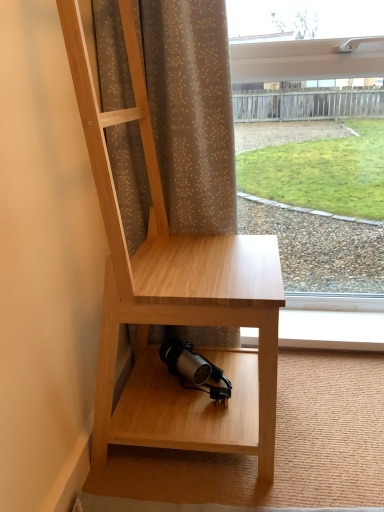
Question: Does point (140, 328) appear closer or farther from the camera than point (140, 203)?

Choices:
 (A) farther
 (B) closer

Answer: (A)

Question: From a real-world perspective, is natural wood desk at center physically located above or below brown sheer curtain at upper center?

Choices:
 (A) below
 (B) above

Answer: (A)

Question: Estimate the real-world distances between objects in this image. Which object is farther from the transparent glass window at upper right?

Choices:
 (A) natural wood desk at center
 (B) brown sheer curtain at upper center

Answer: (A)

Question: Which of these objects is positioned farthest from the natural wood desk at center?

Choices:
 (A) transparent glass window at upper right
 (B) brown sheer curtain at upper center

Answer: (A)